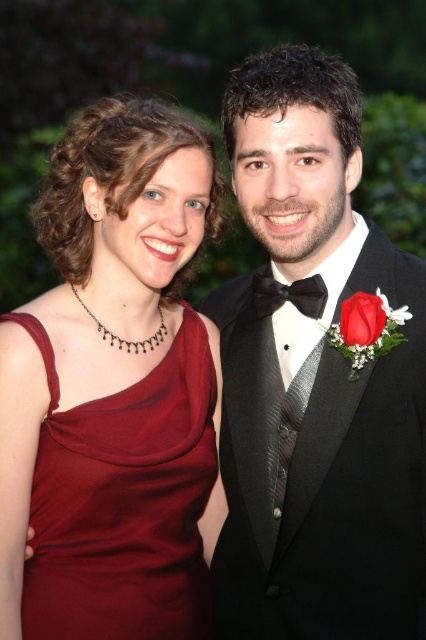
Consider the image. You are a photographer at a formal event. You need to ensure that the distance between the red velvet rose at center and the black satin bow tie at center is at least 8 inches to frame them properly. Based on the scene, is the current distance sufficient?

The red velvet rose at center is 7.77 inches from the black satin bow tie at center, which is less than the required 8 inches. Therefore, the current distance is insufficient for proper framing.

You are a photographer at a formal event. You need to position the two attendees so that their outfits are visible in the photo. The burgundy satin dress at left and the black satin bow tie at center must both be in focus. Given that the dress is wider than the bow tie, which object should you ensure is closer to the camera to maintain focus on both?

Since the burgundy satin dress at left is wider than the black satin bow tie at center, you should position the dress closer to the camera to ensure both are in focus. This way, the wider dress can occupy more space in the frame while the bow tie remains sharp in the foreground.